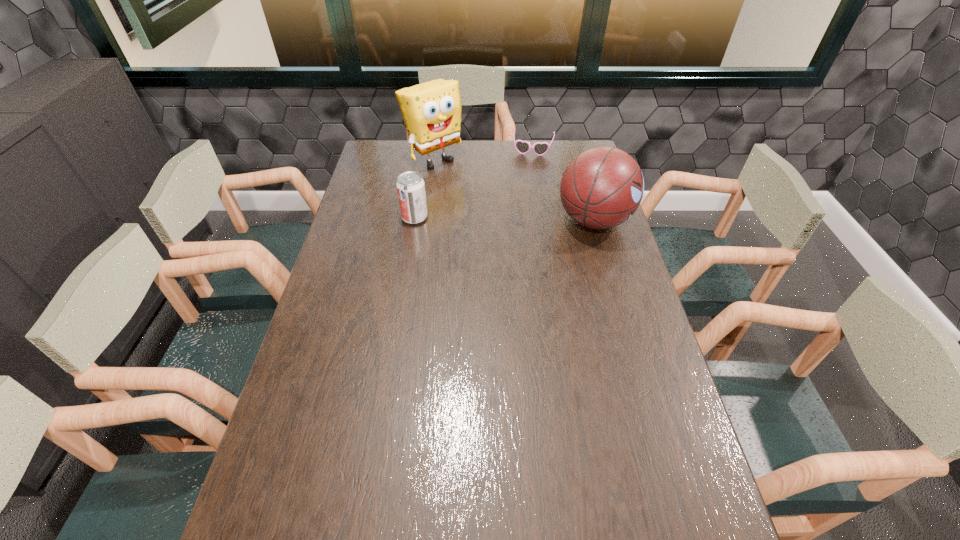
Find the location of `vacant spot on the desktop that is between the soda can and the third shortest object and is positioned on the face of the sponge`. vacant spot on the desktop that is between the soda can and the third shortest object and is positioned on the face of the sponge is located at coordinates (510, 219).

Identify the location of free spot on the desktop that is between the soda can and the basketball and is positioned on the front-facing side of the shortest object. The width and height of the screenshot is (960, 540). (521, 219).